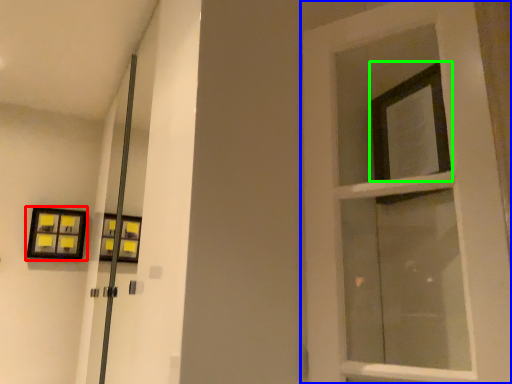
Question: Estimate the real-world distances between objects in this image. Which object is farther from picture frame (highlighted by a red box), door (highlighted by a blue box) or window (highlighted by a green box)?

Choices:
 (A) door
 (B) window

Answer: (B)